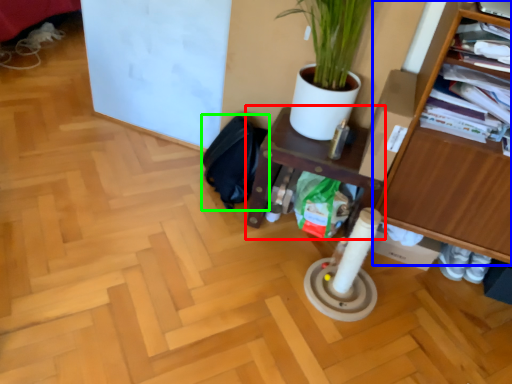
Question: Which is nearer to the shelf (highlighted by a red box)? furniture (highlighted by a blue box) or swivel chair (highlighted by a green box).

Choices:
 (A) furniture
 (B) swivel chair

Answer: (B)